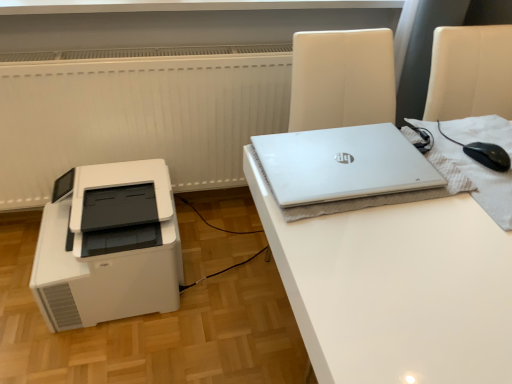
Question: Would you say white plastic printer at lower left is outside silver metallic laptop at upper right?

Choices:
 (A) yes
 (B) no

Answer: (A)

Question: Does white plastic printer at lower left have a larger size compared to silver metallic laptop at upper right?

Choices:
 (A) yes
 (B) no

Answer: (A)

Question: Is white plastic printer at lower left turned away from silver metallic laptop at upper right?

Choices:
 (A) no
 (B) yes

Answer: (A)

Question: Is white plastic printer at lower left far away from silver metallic laptop at upper right?

Choices:
 (A) no
 (B) yes

Answer: (A)

Question: From a real-world perspective, does white plastic printer at lower left sit lower than silver metallic laptop at upper right?

Choices:
 (A) yes
 (B) no

Answer: (A)

Question: Does white plastic printer at lower left have a lesser width compared to silver metallic laptop at upper right?

Choices:
 (A) yes
 (B) no

Answer: (B)

Question: Can you confirm if black matte mouse at right is wider than white glossy desk at upper right?

Choices:
 (A) yes
 (B) no

Answer: (B)

Question: Could you tell me if black matte mouse at right is turned towards white glossy desk at upper right?

Choices:
 (A) yes
 (B) no

Answer: (B)

Question: Is black matte mouse at right located outside white glossy desk at upper right?

Choices:
 (A) no
 (B) yes

Answer: (A)

Question: Is black matte mouse at right thinner than white glossy desk at upper right?

Choices:
 (A) no
 (B) yes

Answer: (B)

Question: Is black matte mouse at right positioned behind white glossy desk at upper right?

Choices:
 (A) no
 (B) yes

Answer: (B)

Question: Can you confirm if black matte mouse at right is positioned to the left of white glossy desk at upper right?

Choices:
 (A) yes
 (B) no

Answer: (A)

Question: Can you confirm if silver metallic laptop at upper right is wider than white plastic printer at lower left?

Choices:
 (A) yes
 (B) no

Answer: (B)